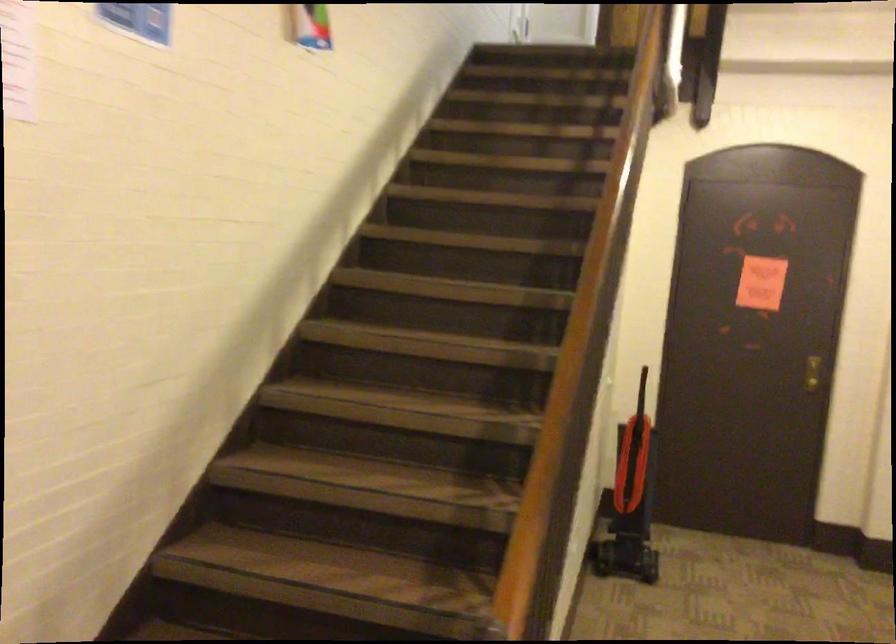
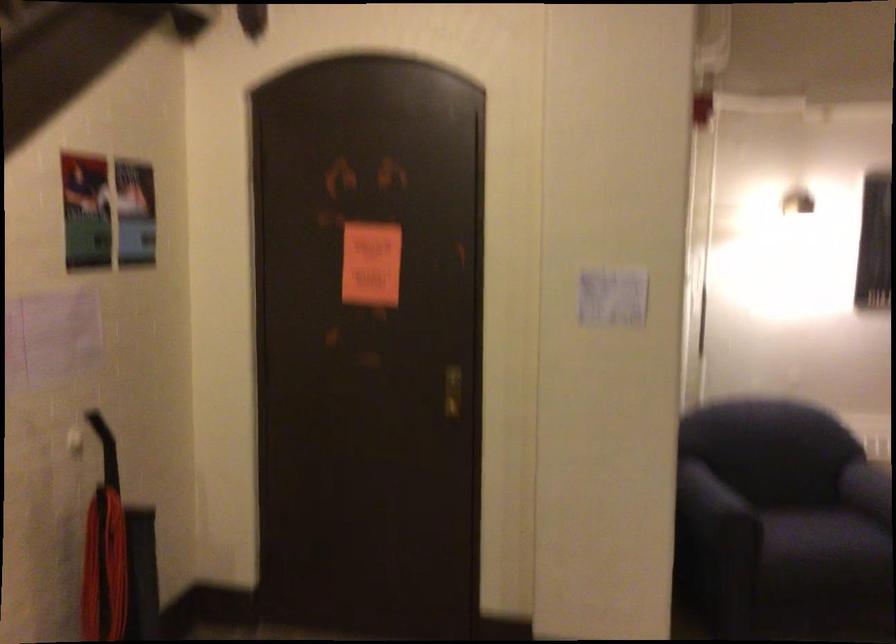
The images are taken continuously from a first-person perspective. In which direction are you moving?

The movement direction of the cameraman is right, forward.